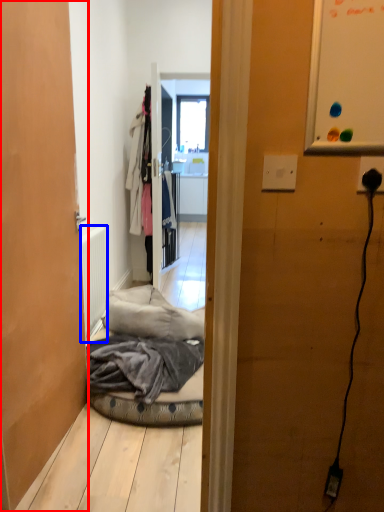
Question: Which point is closer to the camera, door (highlighted by a red box) or radiator (highlighted by a blue box)?

Choices:
 (A) door
 (B) radiator

Answer: (A)